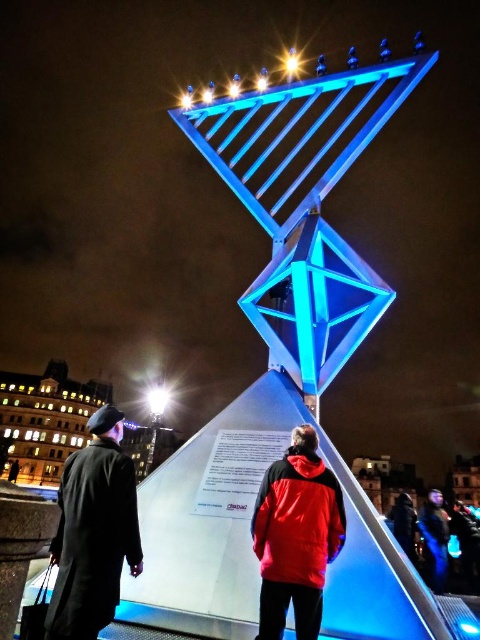
Is dark wool coat at left thinner than red matte jacket at center?

Incorrect, dark wool coat at left's width is not less than red matte jacket at center's.

Measure the distance between point (x=62, y=477) and camera.

The distance of point (x=62, y=477) from camera is 32.10 meters.

Identify the location of dark wool coat at left. This screenshot has width=480, height=640. [x=94, y=531].

Identify the location of dark wool coat at left. The width and height of the screenshot is (480, 640). (94, 531).

Is red matte jacket at center to the right of blue glass light at upper center from the viewer's perspective?

No, red matte jacket at center is not to the right of blue glass light at upper center.

Who is more forward, (300,548) or (288,67)?

Point (300,548) is more forward.

Is point (333, 560) closer to viewer compared to point (285, 67)?

Yes, it is.

The image size is (480, 640). What are the coordinates of `red matte jacket at center` in the screenshot? It's located at (298, 518).

Consider the image. Is dark wool coat at left further to the viewer compared to blue glass light at upper center?

That is False.

Does point (60, 506) come farther from viewer compared to point (287, 65)?

No, (60, 506) is in front of (287, 65).

Is point (93, 420) positioned in front of point (297, 52)?

Yes, it is in front of point (297, 52).

Locate an element on the screen. The width and height of the screenshot is (480, 640). dark wool coat at left is located at coordinates (94, 531).